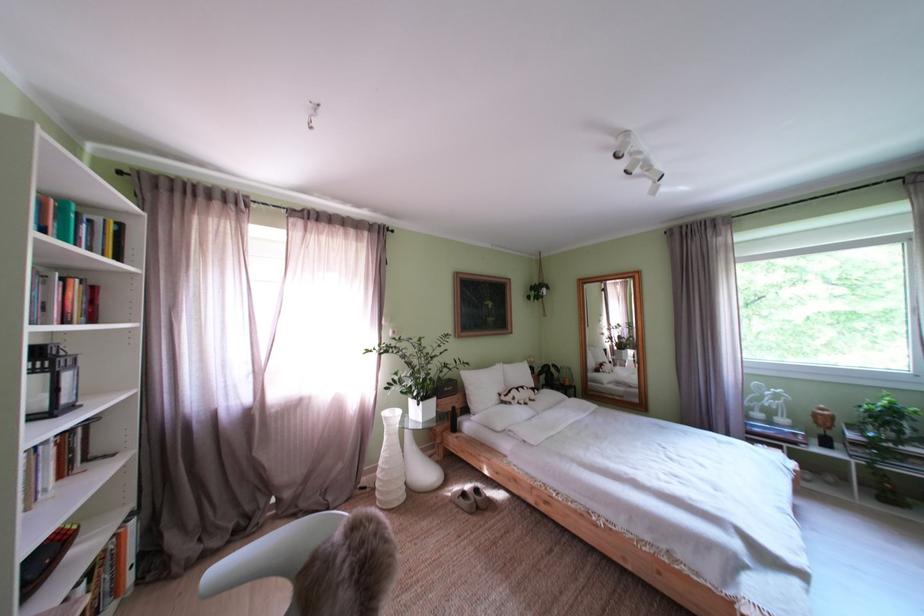
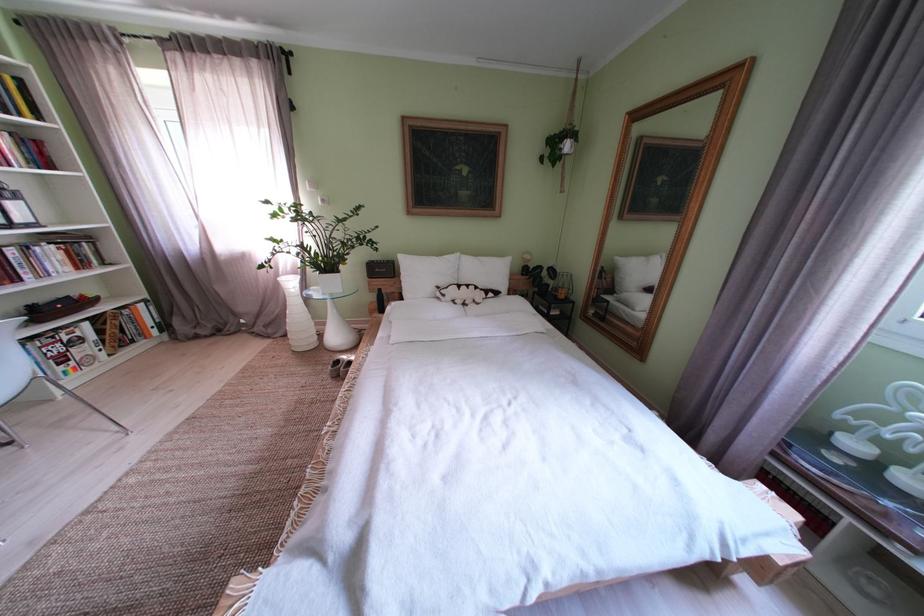
The point at (525, 405) is marked in the first image. Where is the corresponding point in the second image?

(455, 301)